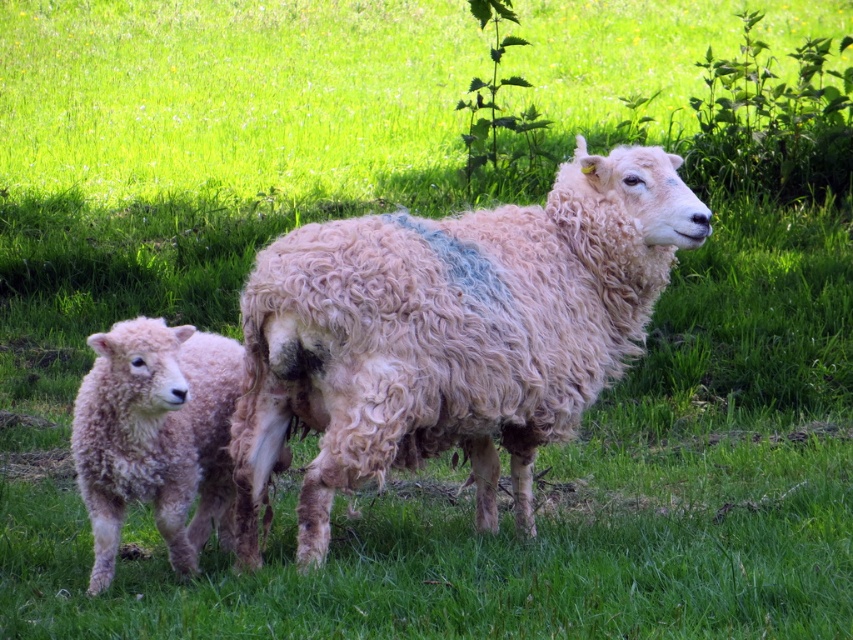
Question: Is curly woolen sheep at center in front of fuzzy woolen lamb at left?

Choices:
 (A) yes
 (B) no

Answer: (B)

Question: Is curly woolen sheep at center wider than fuzzy woolen lamb at left?

Choices:
 (A) no
 (B) yes

Answer: (B)

Question: Which of the following is the closest to the observer?

Choices:
 (A) curly woolen sheep at center
 (B) fuzzy woolen lamb at left

Answer: (B)

Question: Which object is farther from the camera taking this photo?

Choices:
 (A) fuzzy woolen lamb at left
 (B) curly woolen sheep at center

Answer: (B)

Question: Can you confirm if curly woolen sheep at center is positioned above fuzzy woolen lamb at left?

Choices:
 (A) no
 (B) yes

Answer: (B)